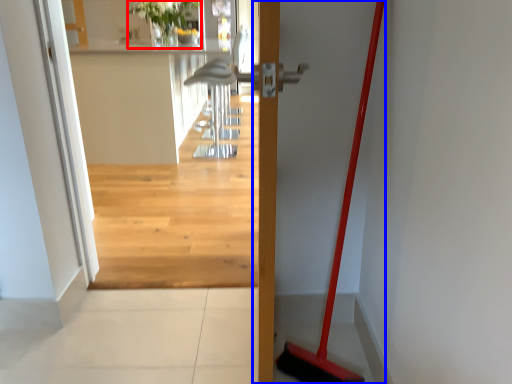
Question: Which point is closer to the camera, plant (highlighted by a red box) or door (highlighted by a blue box)?

Choices:
 (A) plant
 (B) door

Answer: (B)